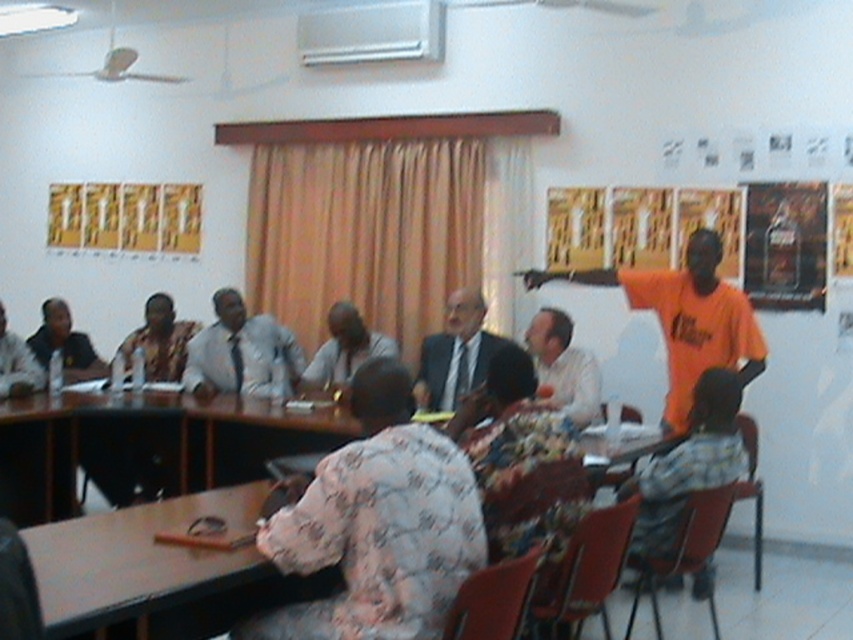
Question: Is floral fabric dress at lower right smaller than matte black shirt at left?

Choices:
 (A) yes
 (B) no

Answer: (B)

Question: Can you confirm if orange t-shirt at upper right is wider than white glossy shirt at center?

Choices:
 (A) yes
 (B) no

Answer: (A)

Question: Which of the following is the farthest from the observer?

Choices:
 (A) floral fabric shirt at center
 (B) light brown fabric shirt at center

Answer: (B)

Question: Which of the following is the closest to the observer?

Choices:
 (A) matte black suit at center
 (B) light brown fabric shirt at center
 (C) white glossy shirt at center

Answer: (C)

Question: Can you confirm if floral fabric shirt at center is positioned below orange t-shirt at upper right?

Choices:
 (A) no
 (B) yes

Answer: (B)

Question: Which object appears closest to the camera in this image?

Choices:
 (A) floral fabric dress at lower right
 (B) floral fabric shirt at center
 (C) white glossy shirt at center

Answer: (B)